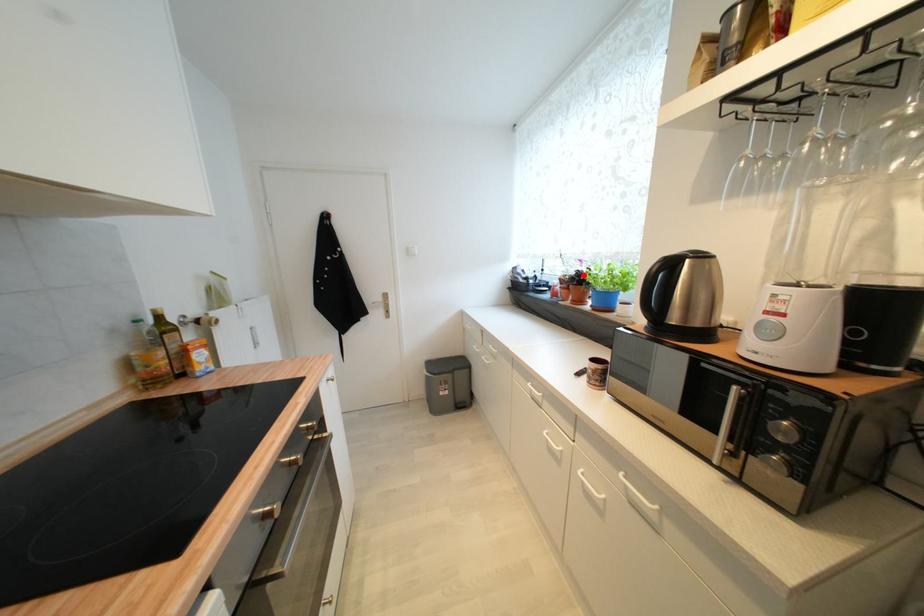
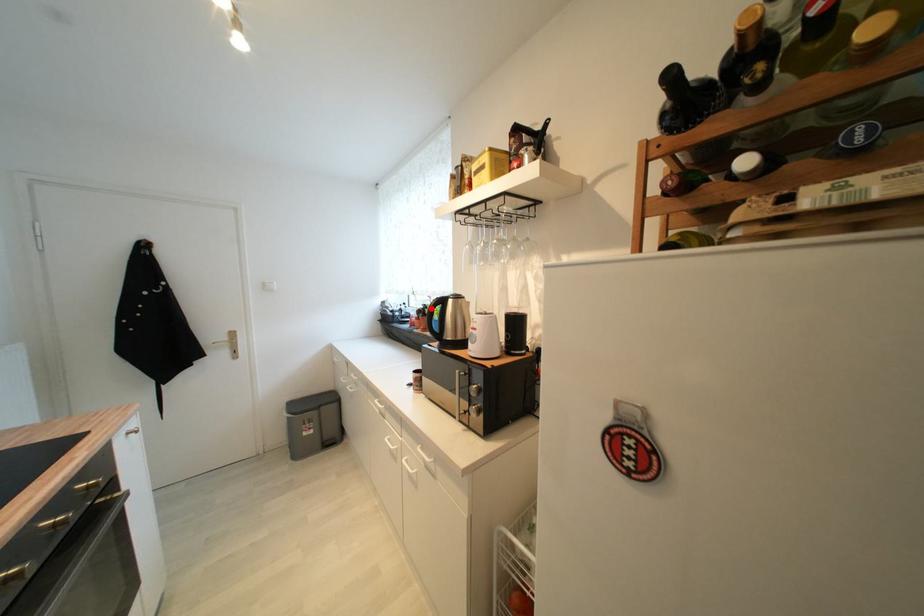
I am providing you with two images of the same scene from different viewpoints. A red point is marked on the first image and another point is marked on the second image. Does the point marked in image1 correspond to the same location as the one in image2?

Yes